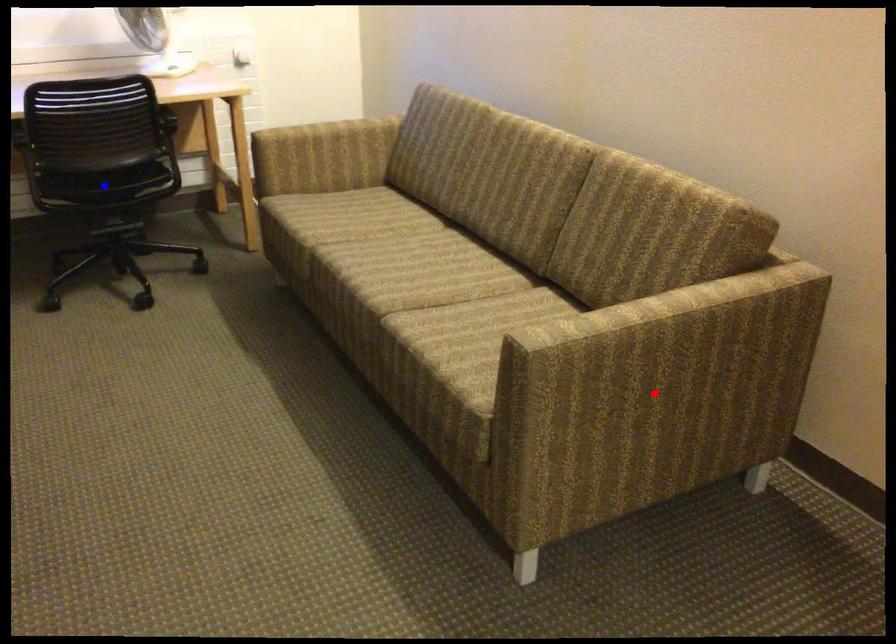
Question: Two points are marked on the image. Which point is closer to the camera?

Choices:
 (A) Blue point is closer.
 (B) Red point is closer.

Answer: (B)